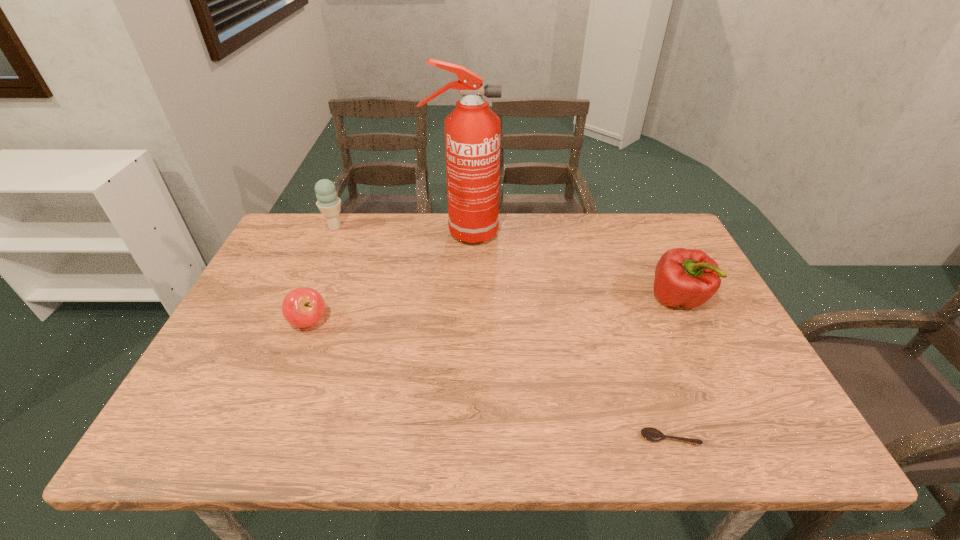
The height and width of the screenshot is (540, 960). What are the coordinates of `free space at the near edge of the desktop` in the screenshot? It's located at (303, 417).

This screenshot has height=540, width=960. I want to click on vacant area at the left edge of the desktop, so click(261, 309).

In the image, there is a desktop. In order to click on vacant area at the right edge in this screenshot , I will do `click(673, 308)`.

Find the location of a particular element. Image resolution: width=960 pixels, height=540 pixels. vacant region at the near left corner of the desktop is located at coordinates [207, 436].

I want to click on vacant region at the far right corner of the desktop, so click(x=668, y=215).

Locate an element on the screen. The image size is (960, 540). free region at the near right corner of the desktop is located at coordinates click(781, 426).

Locate an element on the screen. vacant space that is in between the fire extinguisher and the apple is located at coordinates (386, 278).

Locate an element on the screen. free space between the third object from left to right and the ice cream is located at coordinates (399, 230).

You are a GUI agent. You are given a task and a screenshot of the screen. Output one action in this format:
    pyautogui.click(x=<x>, y=<y>)
    Task: Click on the unoccupied position between the ice cream and the fourth tallest object
    The height and width of the screenshot is (540, 960).
    Given the screenshot: What is the action you would take?
    pyautogui.click(x=322, y=274)

The height and width of the screenshot is (540, 960). Find the location of `free space between the nearest object and the third object from left to right`. free space between the nearest object and the third object from left to right is located at coordinates (566, 336).